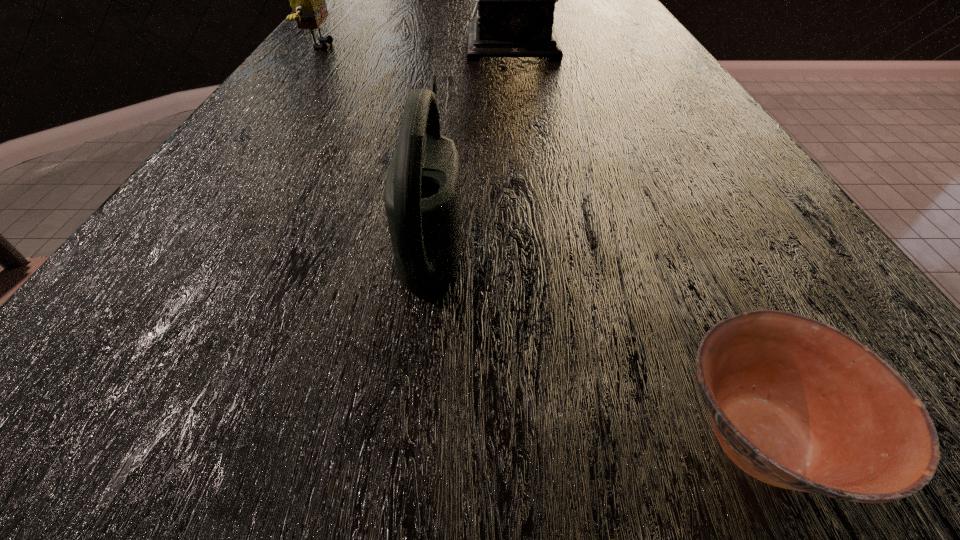
You are a GUI agent. You are given a task and a screenshot of the screen. Output one action in this format:
    pyautogui.click(x=<x>, y=<y>)
    Task: Click on the tallest object
    
    Given the screenshot: What is the action you would take?
    pyautogui.click(x=516, y=0)

Image resolution: width=960 pixels, height=540 pixels. I want to click on sponge, so click(x=307, y=0).

The height and width of the screenshot is (540, 960). Find the location of `the third farthest object`. the third farthest object is located at coordinates (421, 196).

Where is `the shortest object`? The image size is (960, 540). the shortest object is located at coordinates (796, 403).

Where is `the nearest object`? The height and width of the screenshot is (540, 960). the nearest object is located at coordinates (796, 403).

Identify the location of vacant position located 0.050m on the horn of the tallest object. (528, 70).

Image resolution: width=960 pixels, height=540 pixels. In order to click on free space located 0.320m on the face of the leftmost object in this screenshot , I will do `click(474, 46)`.

The width and height of the screenshot is (960, 540). Find the location of `free spot located 0.150m on the spout of the second nearest object`. free spot located 0.150m on the spout of the second nearest object is located at coordinates (576, 232).

At what (x,y) coordinates should I click in order to perform the action: click on blank space located 0.070m on the right of the bowl. Please return your answer as a coordinate pair (x, y). The image size is (960, 540). Looking at the image, I should click on point(930,438).

The height and width of the screenshot is (540, 960). Find the location of `object that is at the near edge`. object that is at the near edge is located at coordinates (796, 403).